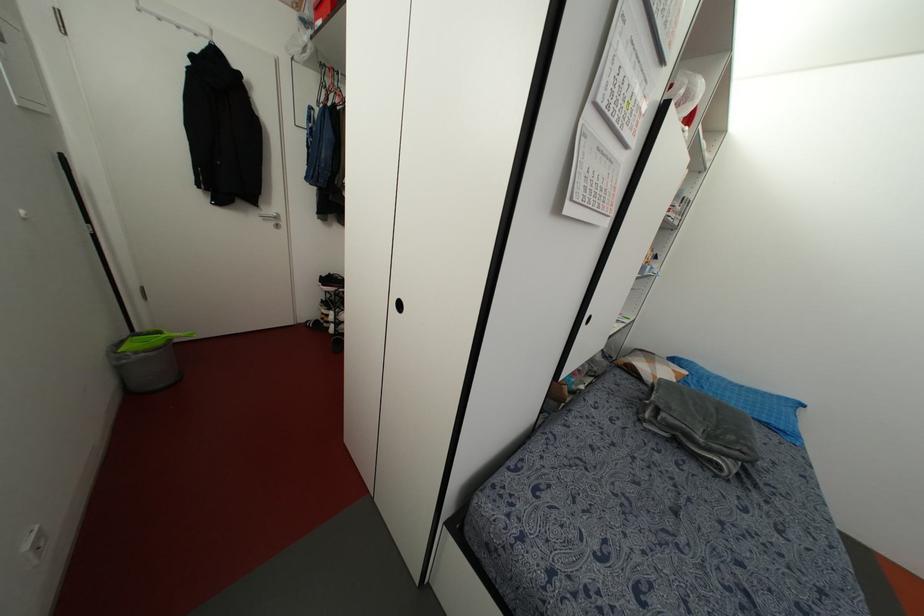
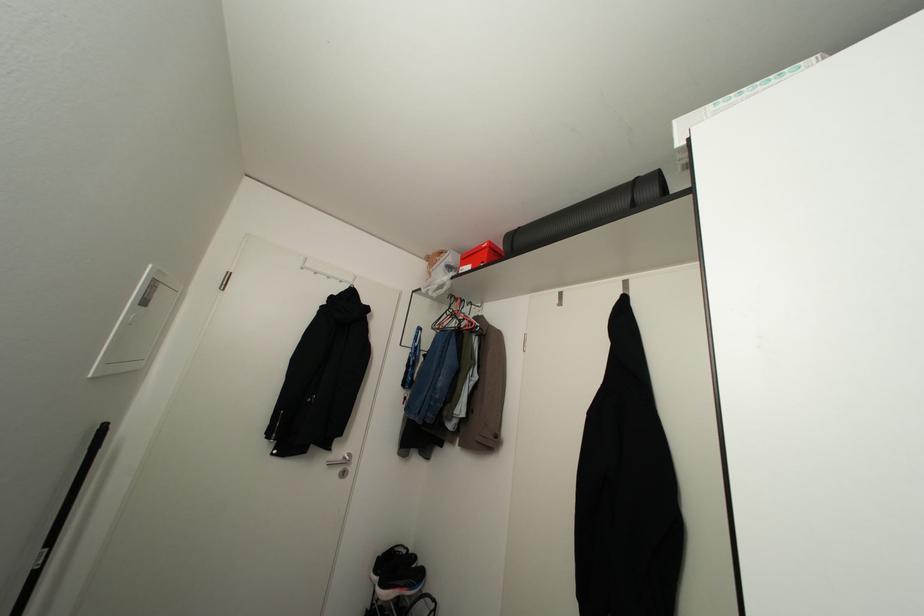
The point at (x=322, y=63) is marked in the first image. Where is the corresponding point in the second image?

(451, 294)